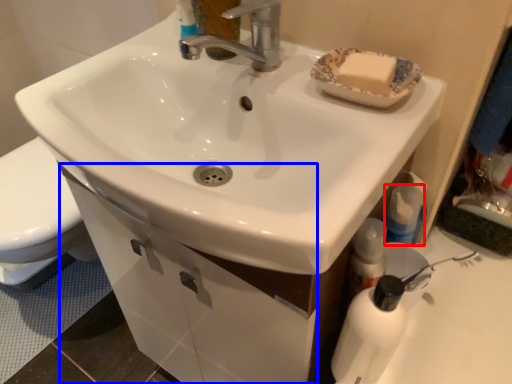
Question: Which object is closer to the camera taking this photo, mouthwash (highlighted by a red box) or drawer (highlighted by a blue box)?

Choices:
 (A) mouthwash
 (B) drawer

Answer: (A)